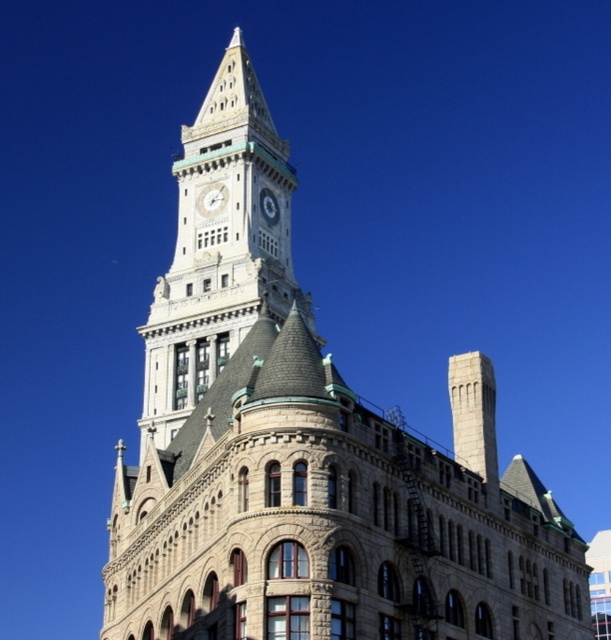
You are an architect examining the historic building. You notice two clocks on the clock tower. The white glossy clock at upper center and the silver metallic clock at center. Which clock has a larger diameter?

The white glossy clock at upper center is bigger than the silver metallic clock at center, so the white glossy clock at upper center has a larger diameter.

You are an architect assessing the building structure. You notice the stone clock tower at center and the silver metallic clock at center. Which one is bigger in size?

The stone clock tower at center is larger in size compared to the silver metallic clock at center.

You are standing in front of the historic building and want to know if the white glossy clock at upper center is positioned higher than the silver metallic clock at center. Can you confirm this based on the building structure?

The white glossy clock at upper center is located above the silver metallic clock at center, so yes, it is positioned higher.